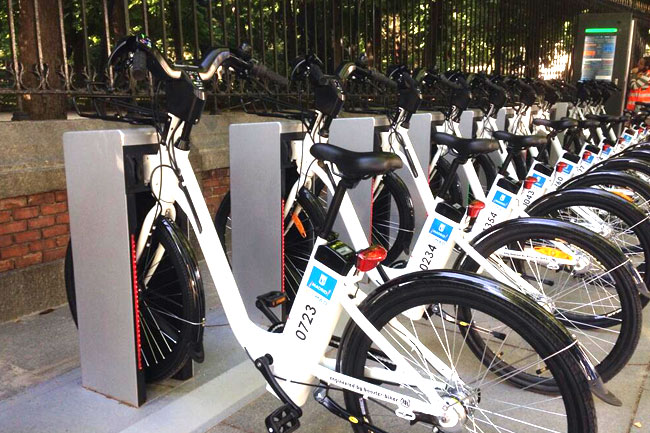
Find the location of a particular element. Image resolution: width=650 pixels, height=433 pixels. left handle is located at coordinates (123, 50), (304, 70), (387, 77), (461, 84), (504, 79), (540, 87), (569, 85), (588, 85).